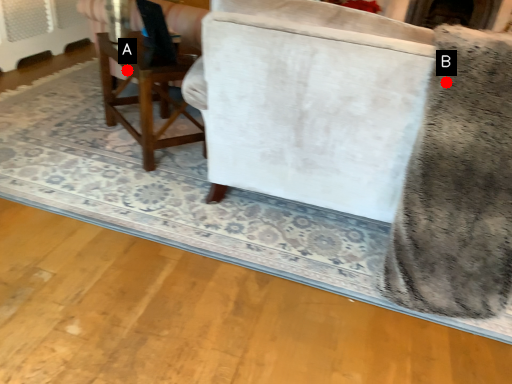
Question: Two points are circled on the image, labeled by A and B beside each circle. Which point is farther to the camera?

Choices:
 (A) A is further
 (B) B is further

Answer: (A)